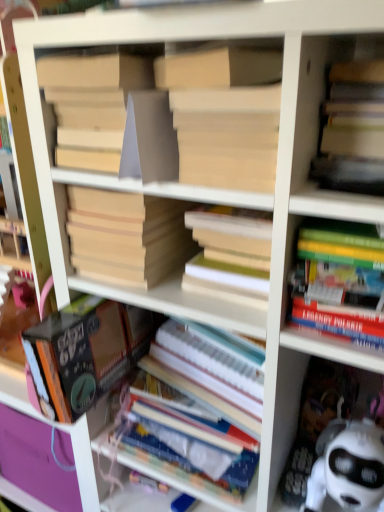
Measure the distance between point (176, 234) and camera.

Point (176, 234) and camera are 26.89 inches apart from each other.

Identify the location of hardcover books at right, which ranks as the fourth book in top-to-bottom order. This screenshot has height=512, width=384. (341, 281).

This screenshot has width=384, height=512. What do you see at coordinates (341, 281) in the screenshot? I see `hardcover books at right, which ranks as the fourth book in top-to-bottom order` at bounding box center [341, 281].

The image size is (384, 512). I want to click on white paper at center, marked as the sixth book in a top-to-bottom arrangement, so click(x=194, y=444).

In order to face hardcover book at center, which is the second book from bottom to top, should I rotate leftwards or rightwards?

It's best to rotate left around 10.184 degrees.

This screenshot has height=512, width=384. Describe the element at coordinates (353, 130) in the screenshot. I see `matte yellow book at upper right, the 5th book positioned from the bottom` at that location.

At what (x,y) coordinates should I click in order to perform the action: click on beige cardboard book at center, marked as the 4th book in a bottom-to-top arrangement. Please return your answer as a coordinate pair (x, y). The image size is (384, 512). Looking at the image, I should click on (126, 234).

Between hardcover book at center, which is the second book from bottom to top, and white paper at center, marked as the sixth book in a top-to-bottom arrangement, which one is positioned in front?

Positioned in front is hardcover book at center, which is the second book from bottom to top.

Is hardcover book at center, which is the fifth book from top to bottom, oriented towards white paper at center, marked as the sixth book in a top-to-bottom arrangement?

Yes, hardcover book at center, which is the fifth book from top to bottom, is facing white paper at center, marked as the sixth book in a top-to-bottom arrangement.

At what (x,y) coordinates should I click in order to perform the action: click on book below the hardcover book at center, which is the second book from bottom to top (from a real-world perspective). Please return your answer as a coordinate pair (x, y). The image size is (384, 512). Looking at the image, I should click on [194, 444].

Who is more distant, hardcover books at right, which ranks as the fourth book in top-to-bottom order, or white paper at center, marked as the sixth book in a top-to-bottom arrangement?

white paper at center, marked as the sixth book in a top-to-bottom arrangement, is behind.

Is hardcover books at right, the third book in the bottom-to-top sequence, next to white paper at center, marked as the sixth book in a top-to-bottom arrangement, and touching it?

No, hardcover books at right, the third book in the bottom-to-top sequence, is not next to white paper at center, marked as the sixth book in a top-to-bottom arrangement.

Is point (335, 247) more distant than point (168, 415)?

No, (335, 247) is in front of (168, 415).

Consider the image. Does hardcover books at right, which ranks as the fourth book in top-to-bottom order, have a lesser height compared to white paper at center, marked as the sixth book in a top-to-bottom arrangement?

Yes.

Is beige cardboard book at center, the third book viewed from the top, in front of or behind matte yellow book at upper right, marked as the 2th book in a top-to-bottom arrangement, in the image?

Visually, beige cardboard book at center, the third book viewed from the top, is located behind matte yellow book at upper right, marked as the 2th book in a top-to-bottom arrangement.

Is beige cardboard book at center, the third book viewed from the top, surrounding matte yellow book at upper right, the 5th book positioned from the bottom?

No, matte yellow book at upper right, the 5th book positioned from the bottom, is not a part of beige cardboard book at center, the third book viewed from the top.

From the picture: Measure the distance between beige cardboard book at center, marked as the 4th book in a bottom-to-top arrangement, and matte yellow book at upper right, the 5th book positioned from the bottom.

A distance of 11.04 inches exists between beige cardboard book at center, marked as the 4th book in a bottom-to-top arrangement, and matte yellow book at upper right, the 5th book positioned from the bottom.

Does beige cardboard book at center, marked as the 4th book in a bottom-to-top arrangement, have a greater height compared to matte yellow book at upper right, marked as the 2th book in a top-to-bottom arrangement?

Yes.

Considering the relative sizes of hardcover books at right, which ranks as the fourth book in top-to-bottom order, and hardcover book at center, which is the fifth book from top to bottom, in the image provided, is hardcover books at right, which ranks as the fourth book in top-to-bottom order, bigger than hardcover book at center, which is the fifth book from top to bottom,?

Actually, hardcover books at right, which ranks as the fourth book in top-to-bottom order, might be smaller than hardcover book at center, which is the fifth book from top to bottom.

From a real-world perspective, which object stands above the other?

In real-world perspective, hardcover books at right, the third book in the bottom-to-top sequence, is above.

Would you say hardcover books at right, the third book in the bottom-to-top sequence, is to the left or to the right of hardcover book at center, which is the fifth book from top to bottom, in the picture?

hardcover books at right, the third book in the bottom-to-top sequence, is positioned on hardcover book at center, which is the fifth book from top to bottom,'s right side.

Which of these two, hardcover books at right, which ranks as the fourth book in top-to-bottom order, or hardcover book at center, which is the second book from bottom to top, stands shorter?

Standing shorter between the two is hardcover books at right, which ranks as the fourth book in top-to-bottom order.

Is matte yellow book at upper right, marked as the 2th book in a top-to-bottom arrangement, completely or partially inside matte cardboard book at center, placed as the 1th book when sorted from top to bottom?

Definitely not — matte yellow book at upper right, marked as the 2th book in a top-to-bottom arrangement, is not inside matte cardboard book at center, placed as the 1th book when sorted from top to bottom.

Between matte cardboard book at center, placed as the 1th book when sorted from top to bottom, and matte yellow book at upper right, the 5th book positioned from the bottom, which one has smaller size?

With smaller size is matte cardboard book at center, placed as the 1th book when sorted from top to bottom.

In order to click on the 3rd book counting from the right of the matte cardboard book at center, which is the 6th book in bottom-to-top order in this screenshot , I will do `click(353, 130)`.

From the picture: Is matte cardboard book at center, placed as the 1th book when sorted from top to bottom, to the left of matte yellow book at upper right, marked as the 2th book in a top-to-bottom arrangement, from the viewer's perspective?

Indeed, matte cardboard book at center, placed as the 1th book when sorted from top to bottom, is positioned on the left side of matte yellow book at upper right, marked as the 2th book in a top-to-bottom arrangement.

From the picture: Can you confirm if white paper at center, marked as the sixth book in a top-to-bottom arrangement, is bigger than hardcover book at center, which is the fifth book from top to bottom?

Indeed, white paper at center, marked as the sixth book in a top-to-bottom arrangement, has a larger size compared to hardcover book at center, which is the fifth book from top to bottom.

How much distance is there between white paper at center, marked as the sixth book in a top-to-bottom arrangement, and hardcover book at center, which is the fifth book from top to bottom?

white paper at center, marked as the sixth book in a top-to-bottom arrangement, is 6.54 inches away from hardcover book at center, which is the fifth book from top to bottom.

Is white paper at center, marked as the sixth book in a top-to-bottom arrangement, not close to hardcover book at center, which is the fifth book from top to bottom?

No, white paper at center, marked as the sixth book in a top-to-bottom arrangement, is not far from hardcover book at center, which is the fifth book from top to bottom.

Does white paper at center, the 1th book when ordered from bottom to top, have a lesser width compared to hardcover book at center, which is the second book from bottom to top?

Correct, the width of white paper at center, the 1th book when ordered from bottom to top, is less than that of hardcover book at center, which is the second book from bottom to top.

In the scene shown: Considering the sizes of objects matte cardboard book at center, which is the 6th book in bottom-to-top order, and beige cardboard book at center, the third book viewed from the top, in the image provided, who is shorter, matte cardboard book at center, which is the 6th book in bottom-to-top order, or beige cardboard book at center, the third book viewed from the top,?

Standing shorter between the two is matte cardboard book at center, which is the 6th book in bottom-to-top order.

Could you measure the distance between matte cardboard book at center, which is the 6th book in bottom-to-top order, and beige cardboard book at center, the third book viewed from the top?

matte cardboard book at center, which is the 6th book in bottom-to-top order, and beige cardboard book at center, the third book viewed from the top, are 13.38 centimeters apart from each other.

Considering the relative positions of matte cardboard book at center, placed as the 1th book when sorted from top to bottom, and beige cardboard book at center, the third book viewed from the top, in the image provided, is matte cardboard book at center, placed as the 1th book when sorted from top to bottom, to the left of beige cardboard book at center, the third book viewed from the top, from the viewer's perspective?

No.

Consider the image. Considering the relative sizes of matte cardboard book at center, placed as the 1th book when sorted from top to bottom, and beige cardboard book at center, the third book viewed from the top, in the image provided, is matte cardboard book at center, placed as the 1th book when sorted from top to bottom, wider than beige cardboard book at center, the third book viewed from the top,?

No.

Identify the location of book that is the 1st object located in front of the white paper at center, marked as the sixth book in a top-to-bottom arrangement. (84, 355).

Starting from the hardcover books at right, which ranks as the fourth book in top-to-bottom order, which book is the 3rd one behind? Please provide its 2D coordinates.

[(194, 444)]

Which object lies nearer to the anchor point beige cardboard book at center, the third book viewed from the top, matte cardboard book at center, placed as the 1th book when sorted from top to bottom, or matte yellow book at upper right, marked as the 2th book in a top-to-bottom arrangement?

The object closer to beige cardboard book at center, the third book viewed from the top, is matte cardboard book at center, placed as the 1th book when sorted from top to bottom.

Which object lies nearer to the anchor point hardcover book at center, which is the fifth book from top to bottom, hardcover books at right, which ranks as the fourth book in top-to-bottom order, or white paper at center, the 1th book when ordered from bottom to top?

white paper at center, the 1th book when ordered from bottom to top, is positioned closer to the anchor hardcover book at center, which is the fifth book from top to bottom.

Based on their spatial positions, is matte yellow book at upper right, the 5th book positioned from the bottom, or matte cardboard book at center, placed as the 1th book when sorted from top to bottom, further from white paper at center, the 1th book when ordered from bottom to top?

matte yellow book at upper right, the 5th book positioned from the bottom, is further to white paper at center, the 1th book when ordered from bottom to top.

Estimate the real-world distances between objects in this image. Which object is closer to hardcover books at right, which ranks as the fourth book in top-to-bottom order, beige cardboard book at center, the third book viewed from the top, or white paper at center, marked as the sixth book in a top-to-bottom arrangement?

The object closer to hardcover books at right, which ranks as the fourth book in top-to-bottom order, is beige cardboard book at center, the third book viewed from the top.

Which object lies further to the anchor point hardcover book at center, which is the fifth book from top to bottom, matte yellow book at upper right, marked as the 2th book in a top-to-bottom arrangement, or white paper at center, the 1th book when ordered from bottom to top?

matte yellow book at upper right, marked as the 2th book in a top-to-bottom arrangement, is positioned further to the anchor hardcover book at center, which is the fifth book from top to bottom.

When comparing their distances from beige cardboard book at center, the third book viewed from the top, does matte yellow book at upper right, the 5th book positioned from the bottom, or hardcover books at right, the third book in the bottom-to-top sequence, seem closer?

hardcover books at right, the third book in the bottom-to-top sequence, is positioned closer to the anchor beige cardboard book at center, the third book viewed from the top.

Considering their positions, is matte cardboard book at center, which is the 6th book in bottom-to-top order, positioned closer to matte yellow book at upper right, marked as the 2th book in a top-to-bottom arrangement, than beige cardboard book at center, marked as the 4th book in a bottom-to-top arrangement?

matte cardboard book at center, which is the 6th book in bottom-to-top order.

Based on their spatial positions, is hardcover book at center, which is the second book from bottom to top, or matte cardboard book at center, which is the 6th book in bottom-to-top order, further from beige cardboard book at center, the third book viewed from the top?

The object further to beige cardboard book at center, the third book viewed from the top, is matte cardboard book at center, which is the 6th book in bottom-to-top order.